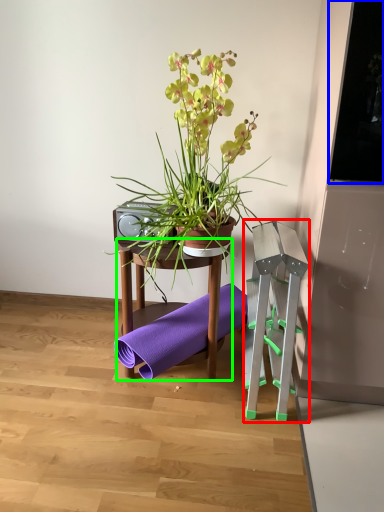
Question: Which object is the farthest from step stool (highlighted by a red box)? Choose among these: window screen (highlighted by a blue box) or table (highlighted by a green box).

Choices:
 (A) window screen
 (B) table

Answer: (A)